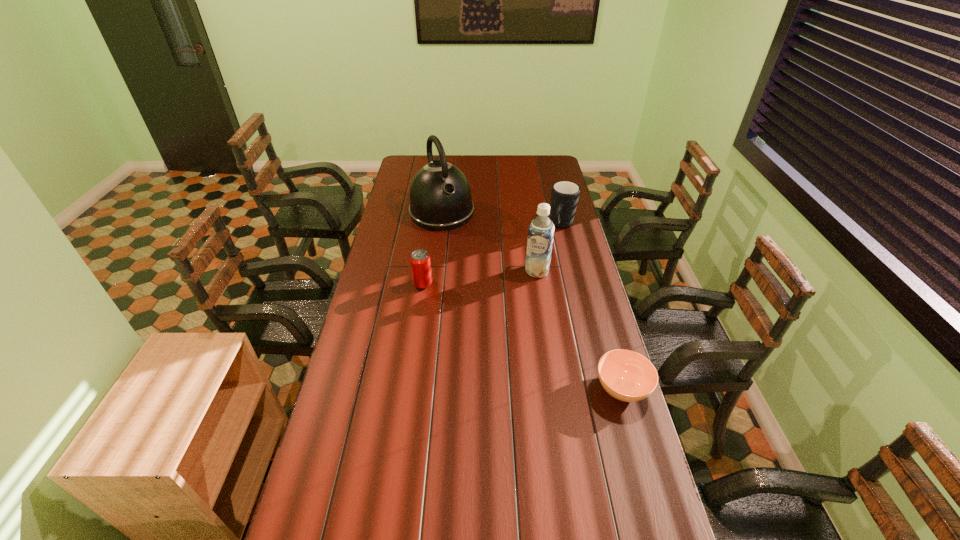
What are the coordinates of `vacant space on the desktop that is between the can and the nearest object and is positioned on the label of the soya milk` in the screenshot? It's located at (515, 333).

Where is `vacant spot on the desktop that is between the can and the nearest object and is positioned on the side of the mug with the handle`? This screenshot has width=960, height=540. vacant spot on the desktop that is between the can and the nearest object and is positioned on the side of the mug with the handle is located at coordinates (509, 329).

The height and width of the screenshot is (540, 960). What are the coordinates of `vacant spot on the desktop that is between the fourth tallest object and the soup bowl and is positioned on the spout of the kettle` in the screenshot? It's located at (510, 330).